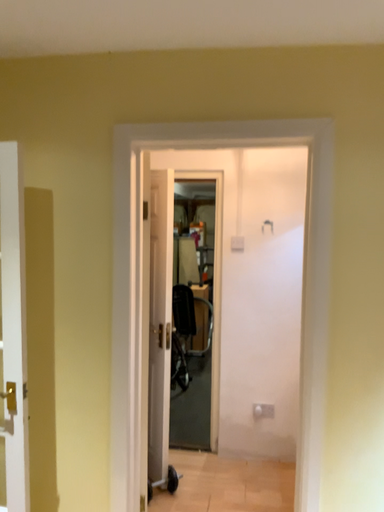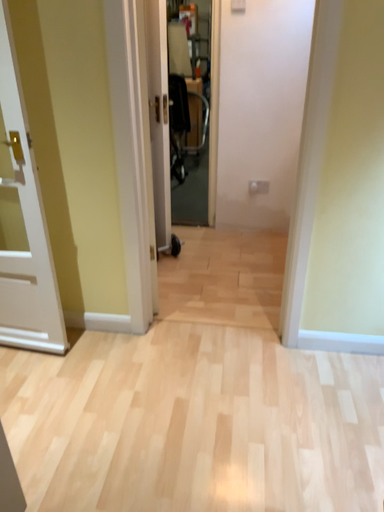
Question: How did the camera likely rotate when shooting the video?

Choices:
 (A) rotated downward
 (B) rotated upward

Answer: (A)